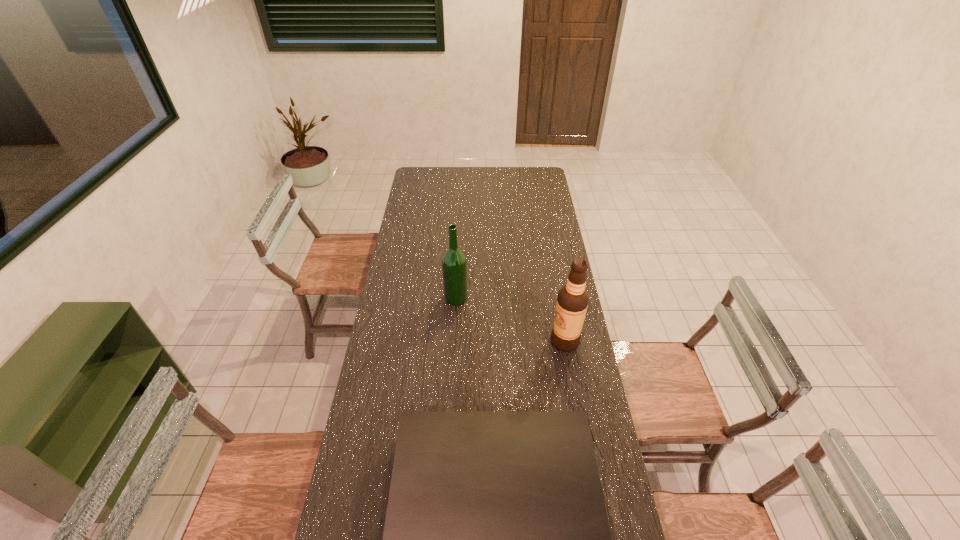
Find the location of a particular element. the right alcohol is located at coordinates (572, 302).

I want to click on the second farthest object, so [x=572, y=302].

Identify the location of the farther alcohol. (x=454, y=262).

The width and height of the screenshot is (960, 540). Identify the location of the farthest object. (454, 262).

This screenshot has height=540, width=960. Find the location of `blank area located on the label of the right alcohol`. blank area located on the label of the right alcohol is located at coordinates (458, 341).

Identify the location of vacant area situated on the label of the right alcohol. (521, 341).

Find the location of a particular element. The height and width of the screenshot is (540, 960). free spot located 0.260m on the label of the right alcohol is located at coordinates (x=482, y=341).

Find the location of a particular element. free spot located 0.080m on the left of the farthest object is located at coordinates (425, 298).

Locate an element on the screen. This screenshot has width=960, height=540. object that is at the right edge is located at coordinates (572, 302).

I want to click on vacant space at the far edge of the desktop, so coord(443,176).